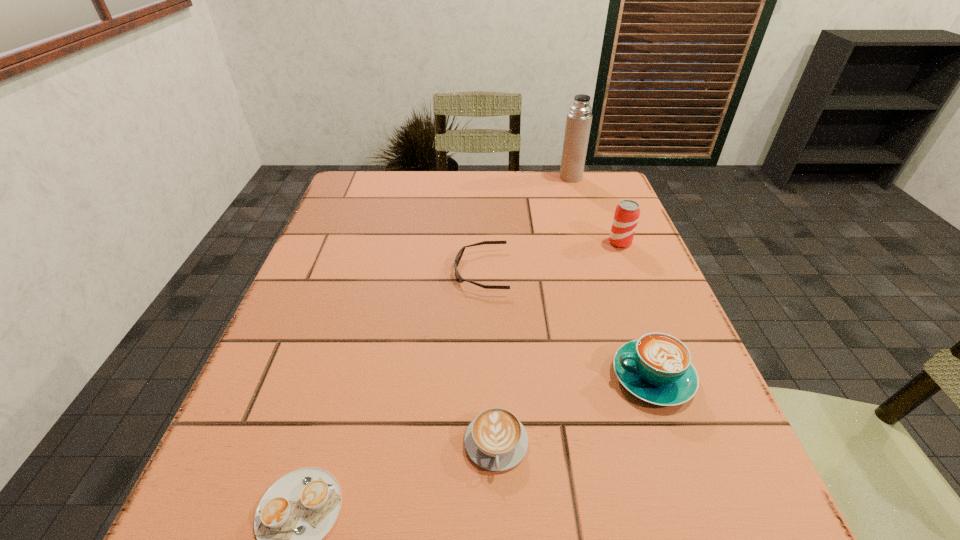
This screenshot has width=960, height=540. What are the coordinates of `beer can that is at the right edge` in the screenshot? It's located at (627, 212).

The width and height of the screenshot is (960, 540). Identify the location of cappuccino that is at the right edge. pyautogui.click(x=657, y=368).

Where is `object positioned at the far right corner`? object positioned at the far right corner is located at coordinates (578, 124).

You are a GUI agent. You are given a task and a screenshot of the screen. Output one action in this format:
    pyautogui.click(x=<x>, y=<y>)
    Task: Click on the free location at the far edge
    
    Given the screenshot: What is the action you would take?
    pyautogui.click(x=507, y=205)

In order to click on vacant area at the left edge of the desktop in this screenshot , I will do `click(373, 288)`.

This screenshot has height=540, width=960. In order to click on vacant space at the right edge in this screenshot , I will do `click(615, 251)`.

In the image, there is a desktop. Identify the location of free space at the far left corner. (388, 194).

The height and width of the screenshot is (540, 960). In the image, there is a desktop. Find the location of `vacant space at the far right corner`. vacant space at the far right corner is located at coordinates (557, 172).

You are a GUI agent. You are given a task and a screenshot of the screen. Output one action in this format:
    pyautogui.click(x=<x>, y=<y>)
    Task: Click on the free space between the second shortest cappuccino and the tallest cappuccino
    The height and width of the screenshot is (540, 960).
    Given the screenshot: What is the action you would take?
    pyautogui.click(x=574, y=410)

The width and height of the screenshot is (960, 540). Find the location of `vacant space that's between the second cappuccino from right to left and the tallest object`. vacant space that's between the second cappuccino from right to left and the tallest object is located at coordinates click(534, 310).